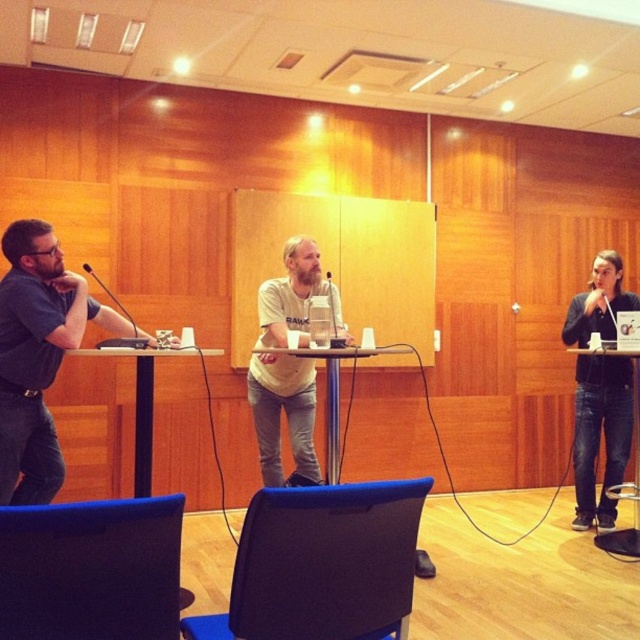
You are standing in the conference room and want to place a 4 meter long banner on the floor. The banner needs to be placed in front of the matte black table at center. Is there enough space between you and the table to lay it out fully?

The matte black table at center is 3.83 meters from the camera, so the banner cannot be fully laid out since it is longer than the available space.

You are a guest speaker preparing to present in the conference room. You need to move from your current position at the blue fabric chair at lower center to the black matte microphone at center. Is the microphone above or below your current position?

The blue fabric chair at lower center is below the black matte microphone at center, so the microphone is above your current position.

You are organizing a small meeting in this conference room and need to place a new decorative item on the table. The item requires a space larger than the blue fabric chair at lower center. Can the black matte microphone at center accommodate this requirement?

The blue fabric chair at lower center is larger in size than the black matte microphone at center. Since the required space must be larger than the blue fabric chair, the black matte microphone at center cannot accommodate this requirement as it is smaller.